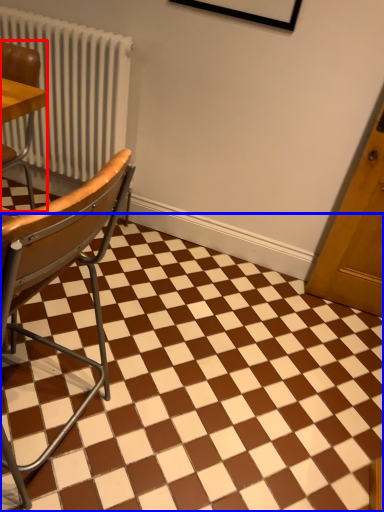
Question: Which point is further to the camera, chair (highlighted by a red box) or square (highlighted by a blue box)?

Choices:
 (A) chair
 (B) square

Answer: (A)